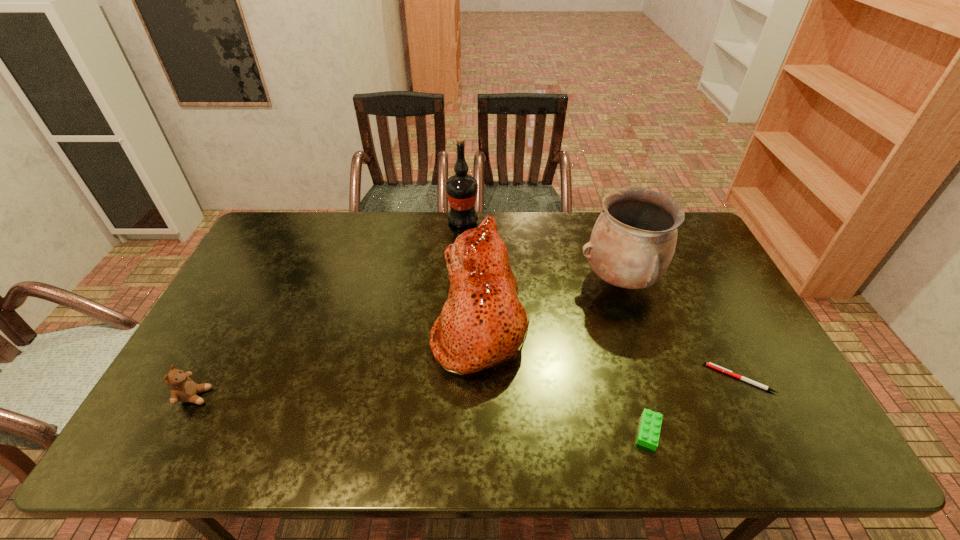
You are a GUI agent. You are given a task and a screenshot of the screen. Output one action in this format:
    pyautogui.click(x=<x>, y=<y>)
    Task: Click on the vacant space situated 0.240m on the back of the urn
    
    Given the screenshot: What is the action you would take?
    pyautogui.click(x=598, y=215)

Find the location of a particular element. free spot located on the face of the cat is located at coordinates (413, 323).

At what (x,y) coordinates should I click in order to perform the action: click on vacant space positioned 0.390m on the face of the cat. Please return your answer as a coordinate pair (x, y). This screenshot has height=540, width=960. Looking at the image, I should click on (299, 323).

The image size is (960, 540). Identify the location of vacant space located on the face of the cat. 402,323.

You are a GUI agent. You are given a task and a screenshot of the screen. Output one action in this format:
    pyautogui.click(x=<x>, y=<y>)
    Task: Click on the vacant space located 0.150m on the front-facing side of the teddy bear
    
    Given the screenshot: What is the action you would take?
    pyautogui.click(x=269, y=396)

This screenshot has height=540, width=960. What are the coordinates of `blank space located on the right of the Lego` in the screenshot? It's located at (776, 431).

Find the location of `vacant region located on the clicker of the pen`. vacant region located on the clicker of the pen is located at coordinates (647, 378).

What are the coordinates of `free space located 0.360m on the clicker of the pen` in the screenshot? It's located at (x=569, y=378).

Find the location of a particular element. This screenshot has height=540, width=960. vacant space located 0.370m on the clicker of the pen is located at coordinates (565, 378).

Identify the location of object positioned at the far edge. (461, 189).